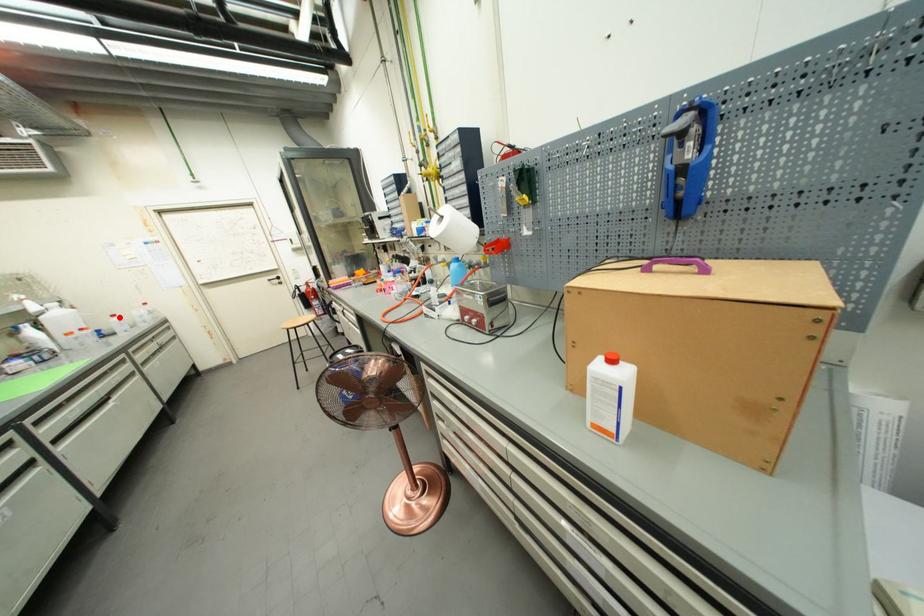
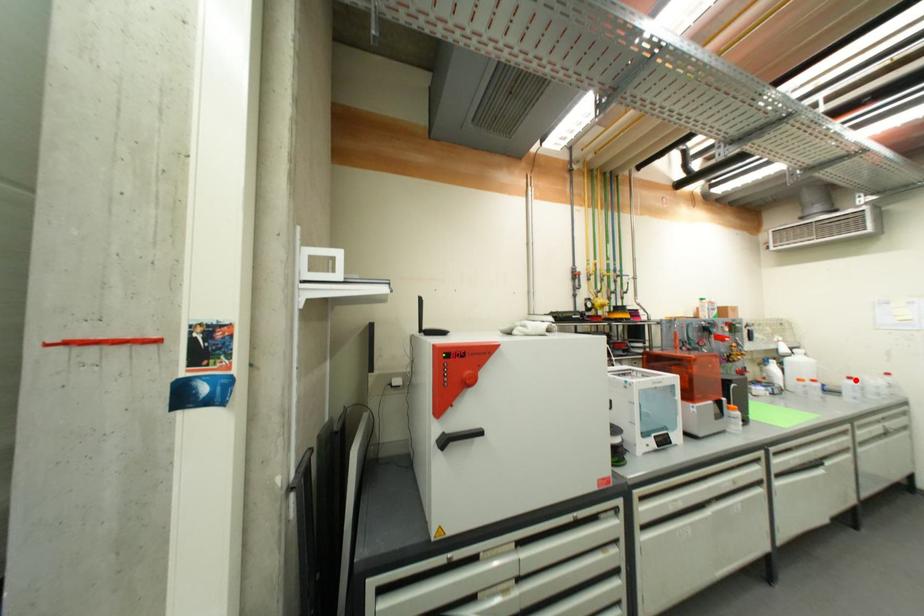
I am providing you with two images of the same scene from different viewpoints. A red point is marked on the first image and another point is marked on the second image. Does the point marked in image1 correspond to the same location as the one in image2?

Yes